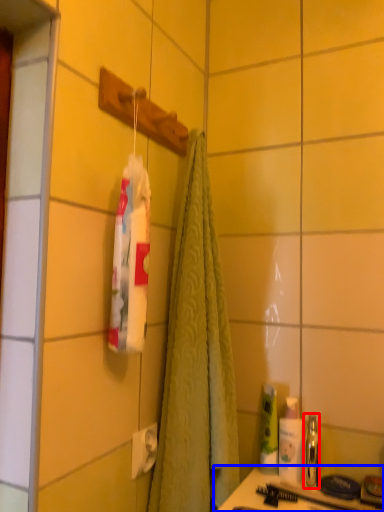
Question: Which of the following is the farthest to the observer, mouthwash (highlighted by a red box) or counter (highlighted by a blue box)?

Choices:
 (A) mouthwash
 (B) counter

Answer: (A)